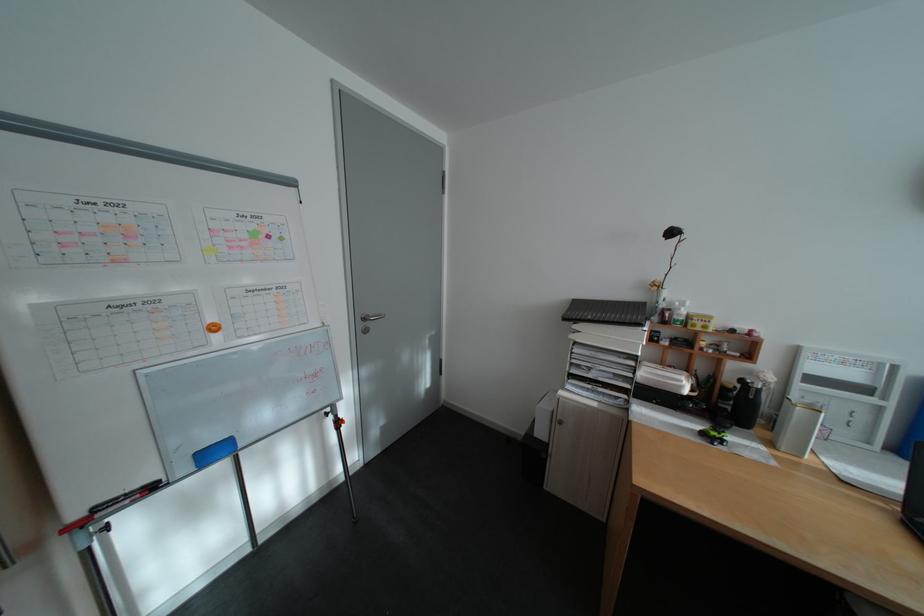
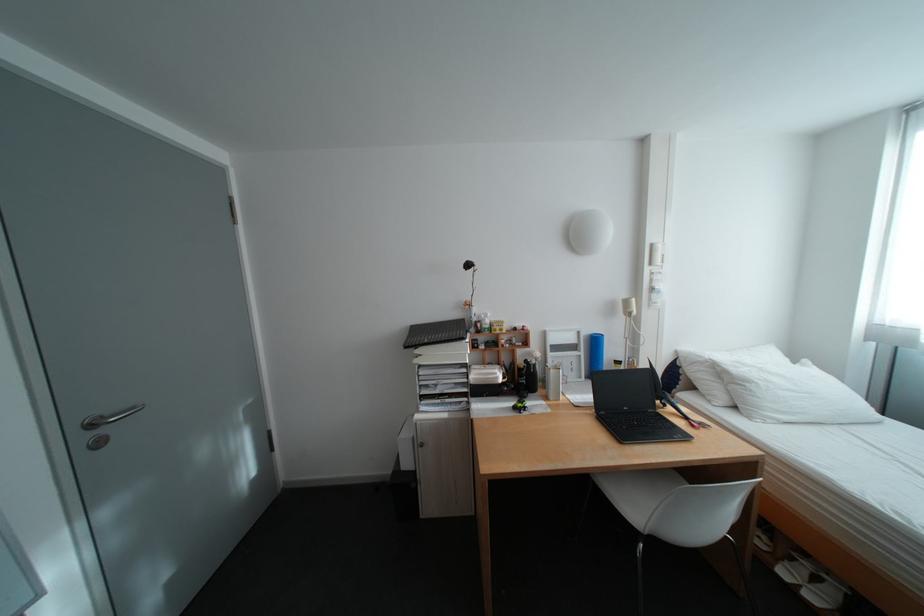
Locate, in the second image, the point that corresponds to (x=374, y=326) in the first image.

(99, 438)